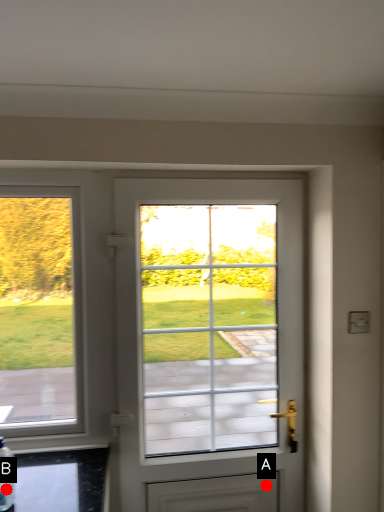
Question: Two points are circled on the image, labeled by A and B beside each circle. Which of the following is the farthest from the observer?

Choices:
 (A) A is further
 (B) B is further

Answer: (A)